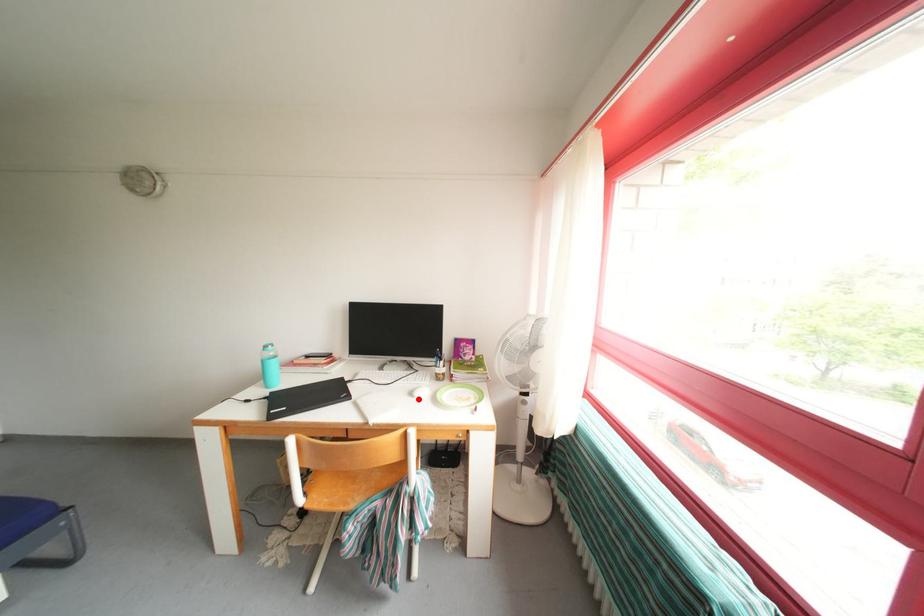
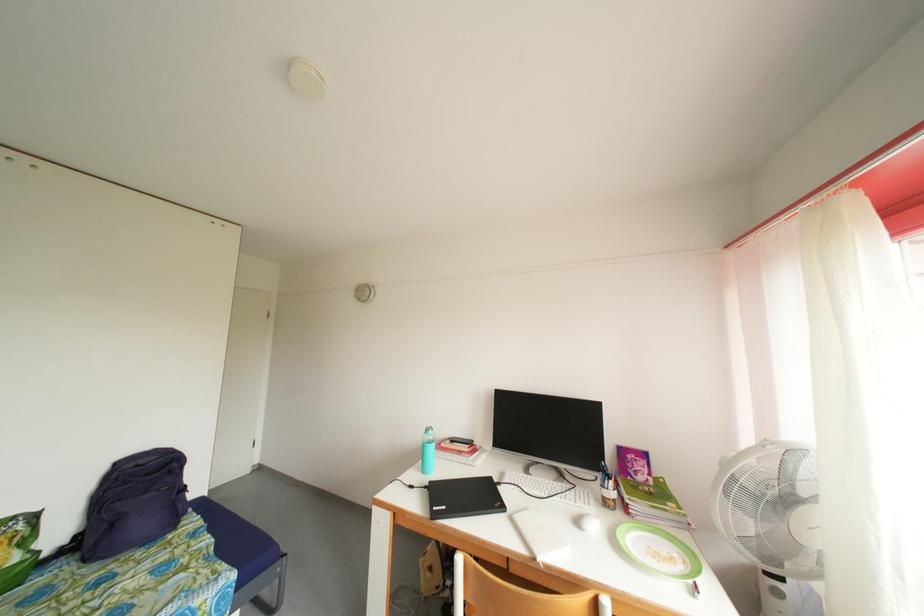
Question: I am providing you with two images of the same scene from different viewpoints. A red point is marked on the first image. At the location where the point appears in image 1, is it still visible in image 2?

Choices:
 (A) Yes
 (B) No

Answer: (A)